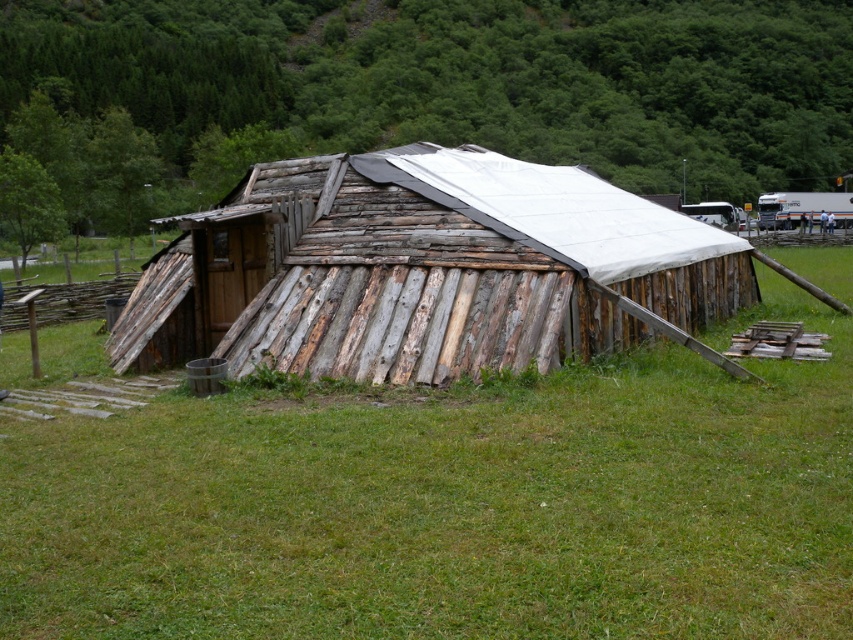
You are planning to set up a picnic blanket in the grassy area. Which area has enough space to accommodate a large picnic blanket, the green grassy at center or the green leafy hillside at upper center?

The green leafy hillside at upper center is larger than the green grassy at center, so it can accommodate a large picnic blanket better.